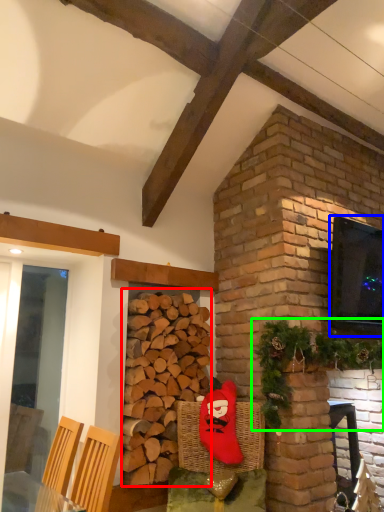
Question: Considering the real-world distances, which object is farthest from brickwork (highlighted by a red box)? window screen (highlighted by a blue box) or christmas decoration (highlighted by a green box)?

Choices:
 (A) window screen
 (B) christmas decoration

Answer: (A)